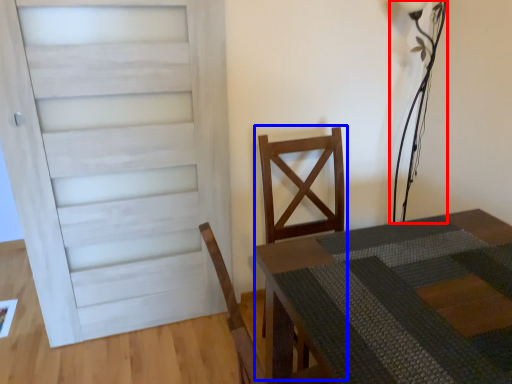
Question: Which object appears closest to the camera in this image, table lamp (highlighted by a red box) or armchair (highlighted by a blue box)?

Choices:
 (A) table lamp
 (B) armchair

Answer: (B)